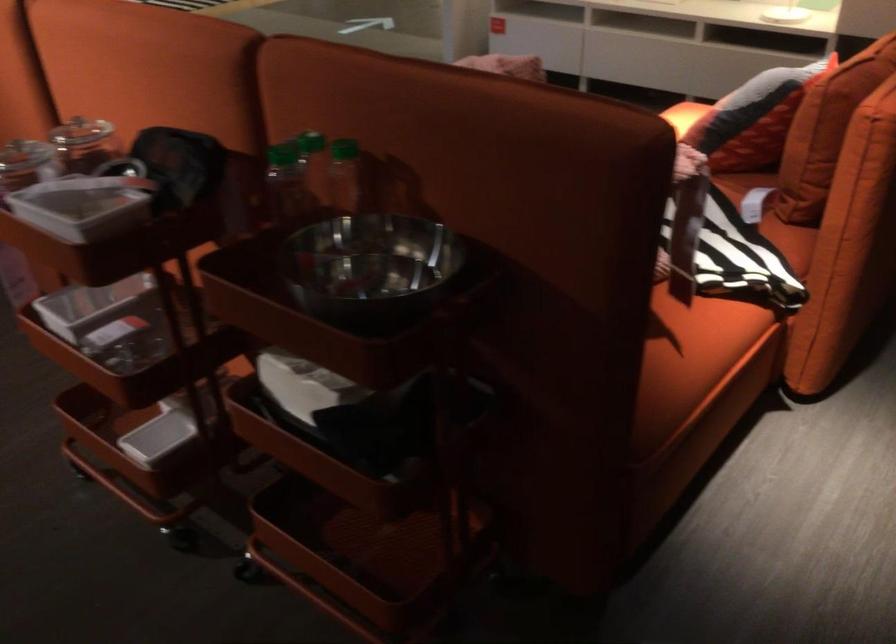
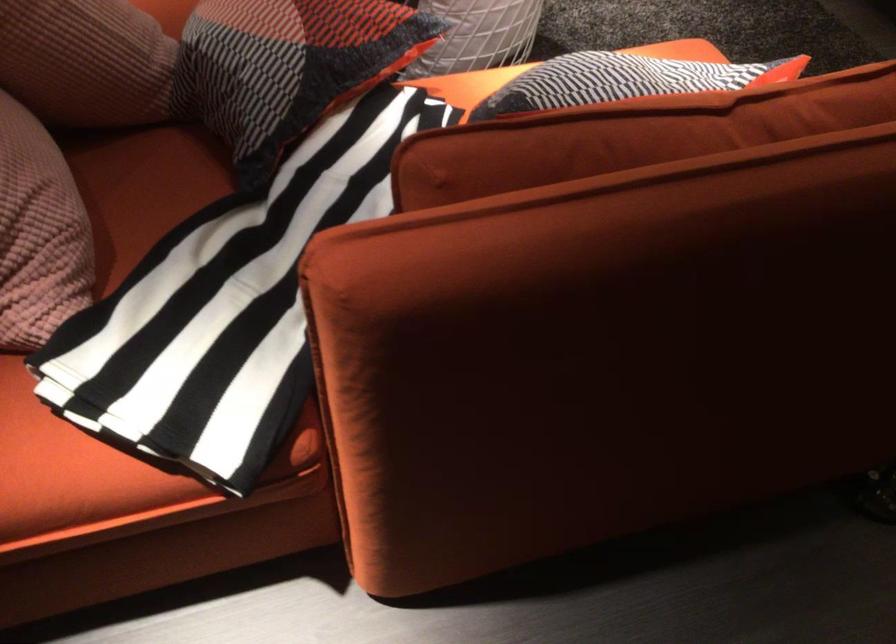
Locate, in the second image, the point that corresponds to the point at 803,67 in the first image.

(623, 80)